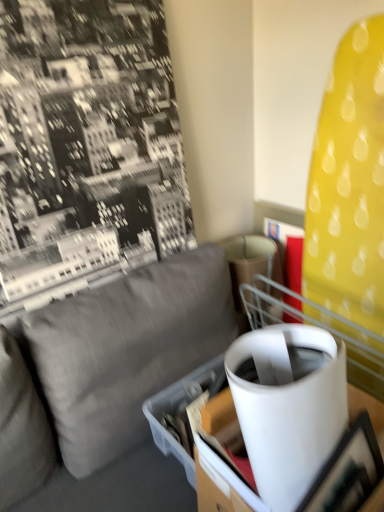
Question: Considering the relative positions of cardboard box at center and white glossy table at center in the image provided, is cardboard box at center to the left or to the right of white glossy table at center?

Choices:
 (A) right
 (B) left

Answer: (B)

Question: Does point (167, 450) appear closer or farther from the camera than point (377, 502)?

Choices:
 (A) farther
 (B) closer

Answer: (A)

Question: Which of these objects is positioned closest to the gray fabric couch at center?

Choices:
 (A) cardboard box at center
 (B) matte black picture frame at lower right
 (C) white glossy table at center

Answer: (A)

Question: Which object is positioned closest to the cardboard box at center?

Choices:
 (A) gray fabric couch at center
 (B) white glossy table at center
 (C) matte black picture frame at lower right

Answer: (A)